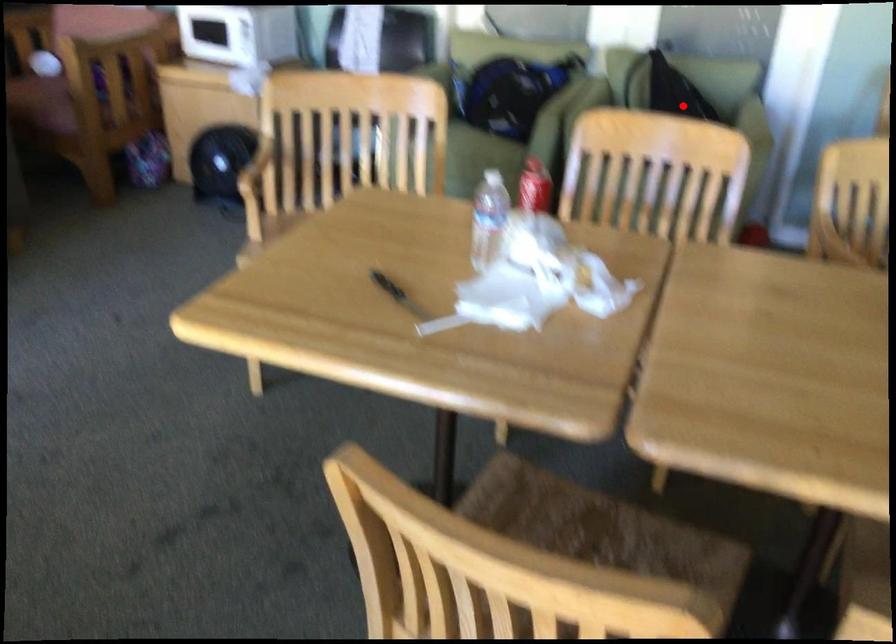
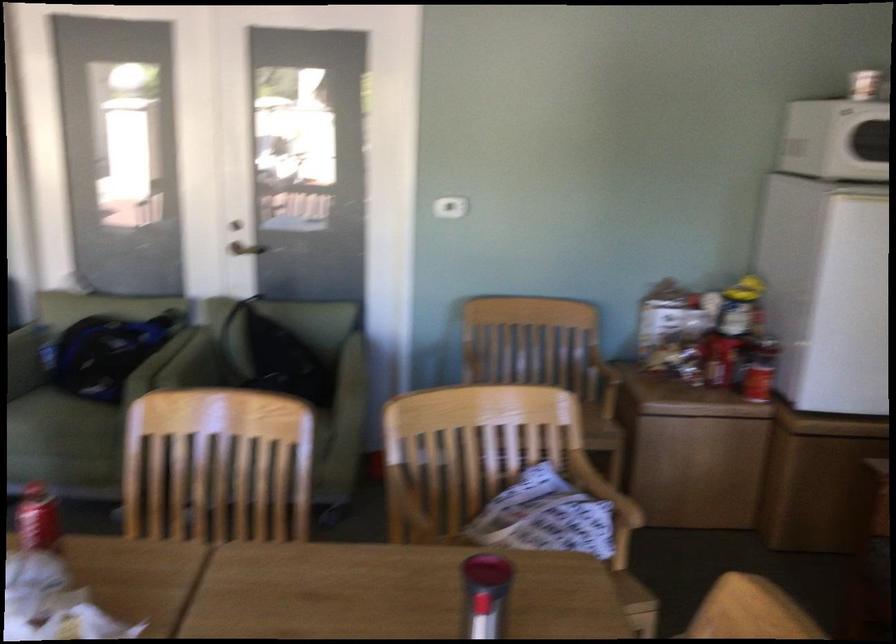
Locate, in the second image, the point that corresponds to the highlighted location in the first image.

(282, 359)